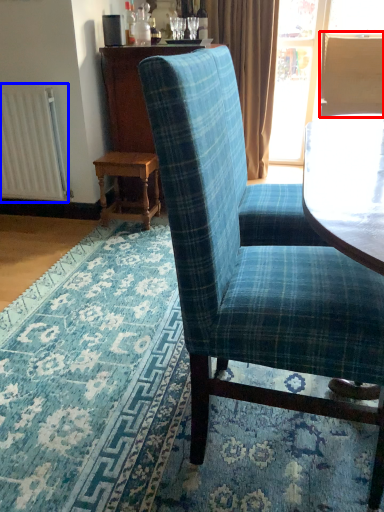
Question: Which object appears farthest to the camera in this image, back (highlighted by a red box) or radiator (highlighted by a blue box)?

Choices:
 (A) back
 (B) radiator

Answer: (A)